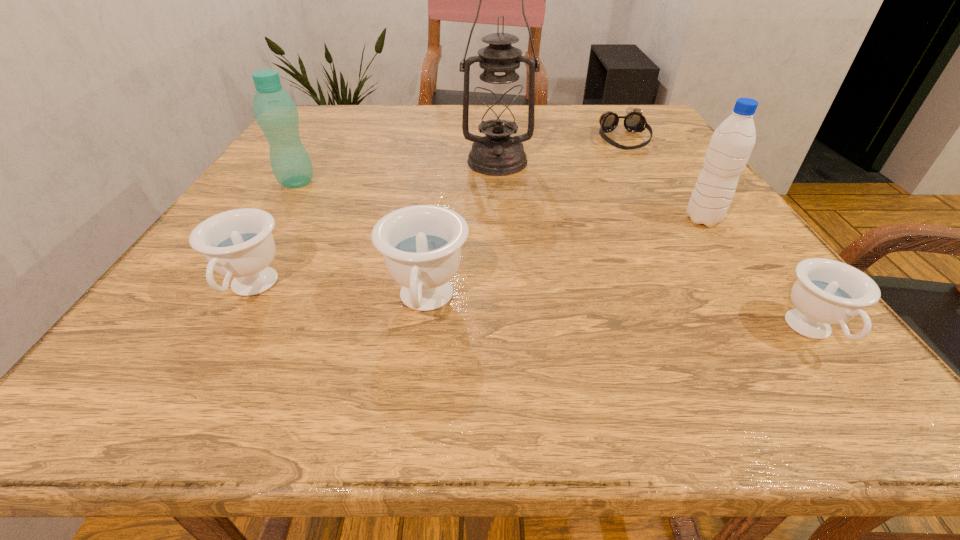
Locate an element on the screen. free space between the shortest teacup and the second teacup from left to right is located at coordinates (619, 318).

Identify the location of free space between the second shortest object and the second teacup from right to left. The image size is (960, 540). (619, 318).

This screenshot has width=960, height=540. I want to click on vacant point located between the oil lamp and the rightmost teacup, so click(655, 247).

Identify the location of free space between the water bottle and the bottle. (500, 200).

Where is `vacant space that's between the water bottle and the bottle`? The height and width of the screenshot is (540, 960). vacant space that's between the water bottle and the bottle is located at coordinates (500, 200).

The height and width of the screenshot is (540, 960). What are the coordinates of `free area in between the tallest object and the bottle` in the screenshot? It's located at (396, 172).

Find the location of a particular element. object that is the sixth closest one to the water bottle is located at coordinates (276, 113).

The width and height of the screenshot is (960, 540). In order to click on the fifth closest object relative to the bottle in this screenshot , I will do `click(731, 144)`.

Image resolution: width=960 pixels, height=540 pixels. I want to click on teacup that is the second closest to the shortest object, so click(421, 245).

At what (x,y) coordinates should I click in order to perform the action: click on teacup that stands as the closest to the goggles. Please return your answer as a coordinate pair (x, y). The width and height of the screenshot is (960, 540). Looking at the image, I should click on (827, 291).